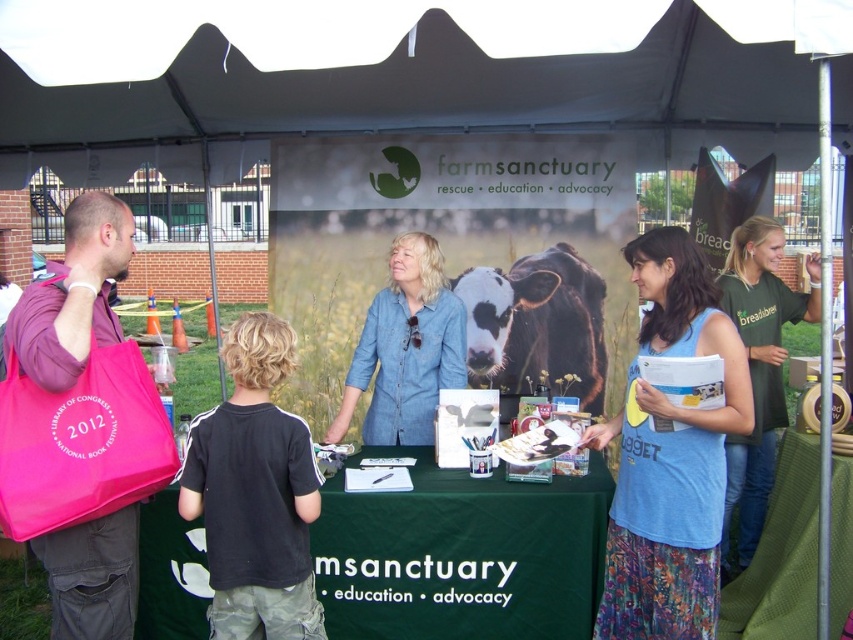
You are a volunteer at the Farmsanctuary event and need to hand out pamphlets from the green fabric table at center to attendees. A attendee is standing near the pink fabric bag at left. Can you reach them without leaving the table?

The green fabric table at center is 1.31 meters away from the pink fabric bag at left. Since the attendee is near the pink fabric bag at left, you can reach them from the green fabric table at center without needing to leave the table as the distance is manageable.

You are a volunteer at the Farmsanctuary event and need to hand out pamphlets to both the person wearing the denim shirt at center and the person wearing the green jersey at right. What is the minimum distance you need to walk to reach both individuals if you start at the table?

The denim shirt at center and green jersey at right are 1.70 meters apart from each other. To reach both individuals starting from the table, you would need to walk at least 1.70 meters in total, assuming you go directly from one to the other without backtracking.

You are attending an outdoor event and see the white fabric canopy at upper center and the pink fabric bag at left. Which object is located above the other?

The white fabric canopy at upper center is positioned over the pink fabric bag at left, so it is located above it.